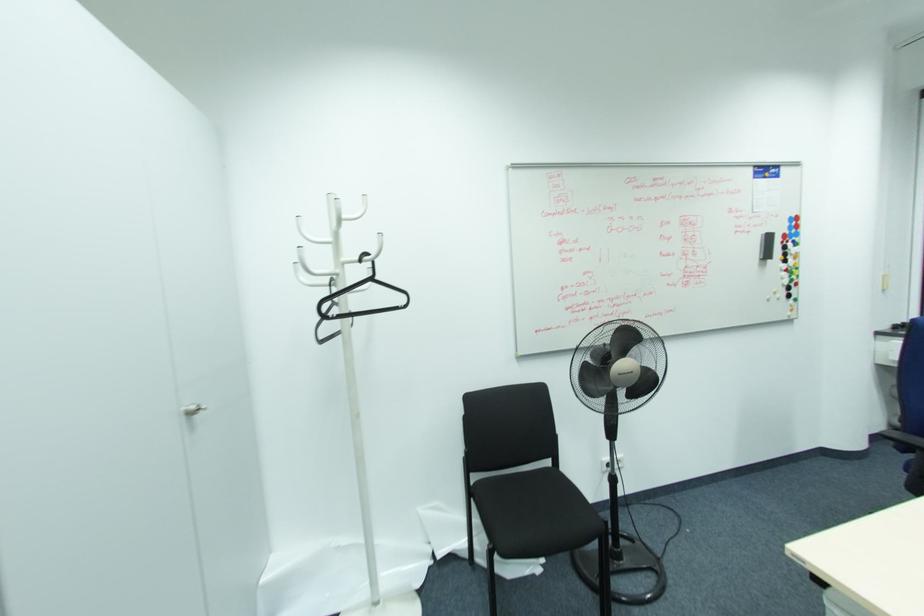
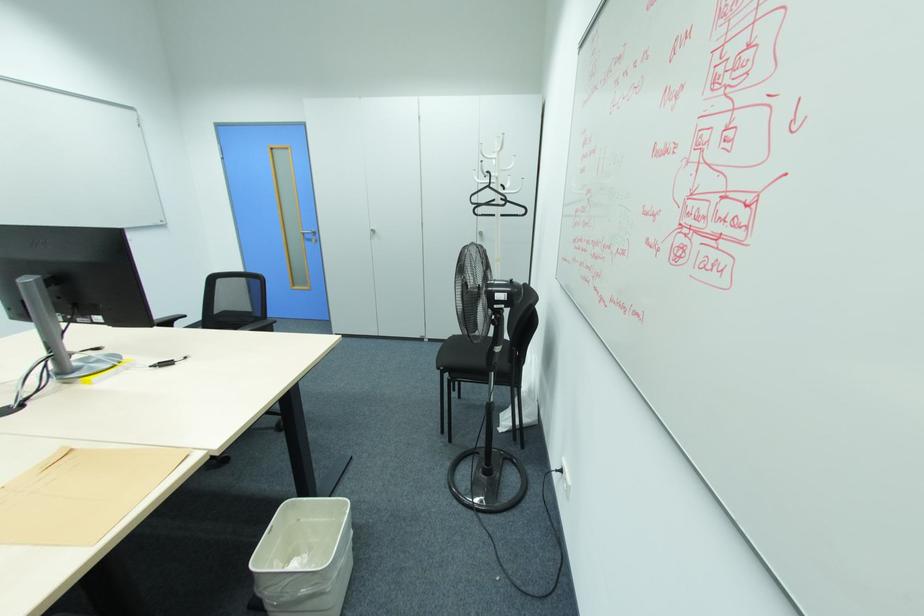
Question: I am providing you with two images of the same scene from different viewpoints. Please identify which objects are invisible in image2.

Choices:
 (A) black clothes hanger
 (B) brown paper folder
 (C) white coat rack hook
 (D) none of these

Answer: (D)